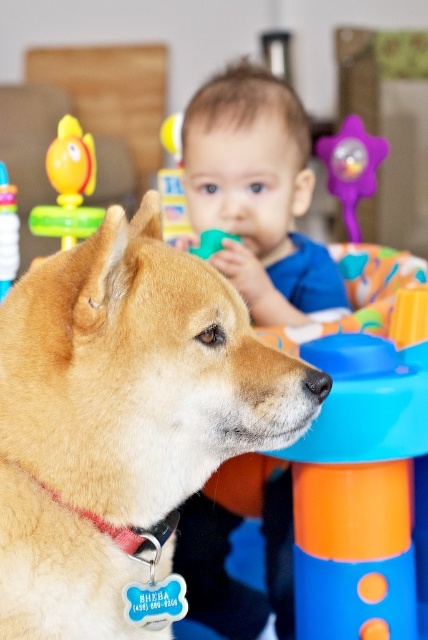
Looking at this image, which is below, blue cotton shirt at upper center or rubberized plastic block at upper center?

blue cotton shirt at upper center is lower down.

Measure the distance between blue cotton shirt at upper center and rubberized plastic block at upper center.

A distance of 11.42 inches exists between blue cotton shirt at upper center and rubberized plastic block at upper center.

Is point (223, 112) less distant than point (158, 170)?

Yes, it is in front of point (158, 170).

The image size is (428, 640). What are the coordinates of `blue cotton shirt at upper center` in the screenshot? It's located at (258, 193).

Between point (285, 129) and point (371, 170), which one is positioned behind?

Positioned behind is point (371, 170).

Is blue cotton shirt at upper center smaller than purple plastic star at upper center?

Actually, blue cotton shirt at upper center might be larger than purple plastic star at upper center.

The image size is (428, 640). What do you see at coordinates (258, 193) in the screenshot? I see `blue cotton shirt at upper center` at bounding box center [258, 193].

Find the location of a particular element. This screenshot has width=428, height=640. blue cotton shirt at upper center is located at coordinates (258, 193).

Which is more to the left, rubberized plastic block at upper center or rubber duck at left?

rubber duck at left is more to the left.

Between rubberized plastic block at upper center and rubber duck at left, which one appears on the right side from the viewer's perspective?

rubberized plastic block at upper center is more to the right.

Identify the location of rubberized plastic block at upper center. (172, 182).